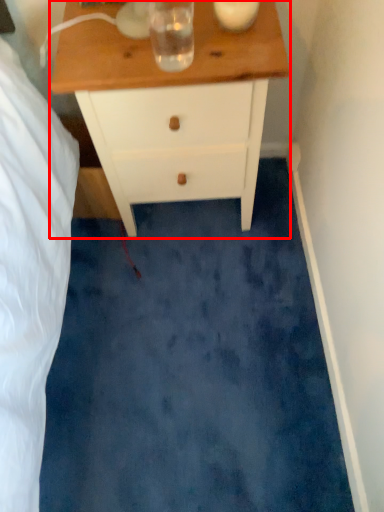
Question: From the image's perspective, considering the relative positions of chest of drawers (annotated by the red box) and beverage in the image provided, where is chest of drawers (annotated by the red box) located with respect to the staircase?

Choices:
 (A) below
 (B) above

Answer: (A)